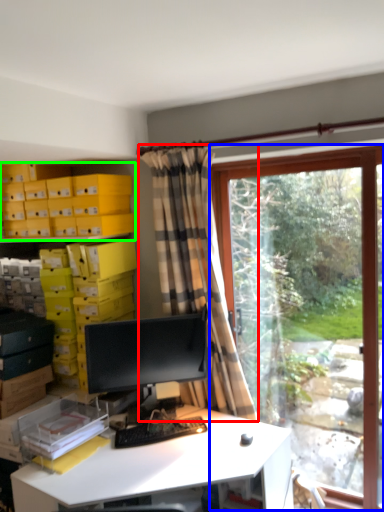
Question: Estimate the real-world distances between objects in this image. Which object is farther from curtain (highlighted by a red box), window (highlighted by a blue box) or shelf (highlighted by a green box)?

Choices:
 (A) window
 (B) shelf

Answer: (B)